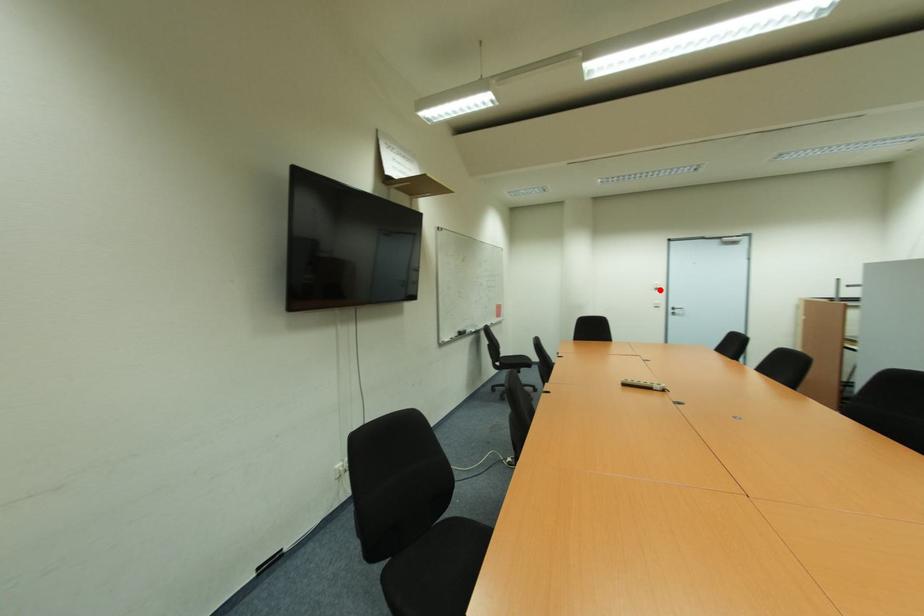
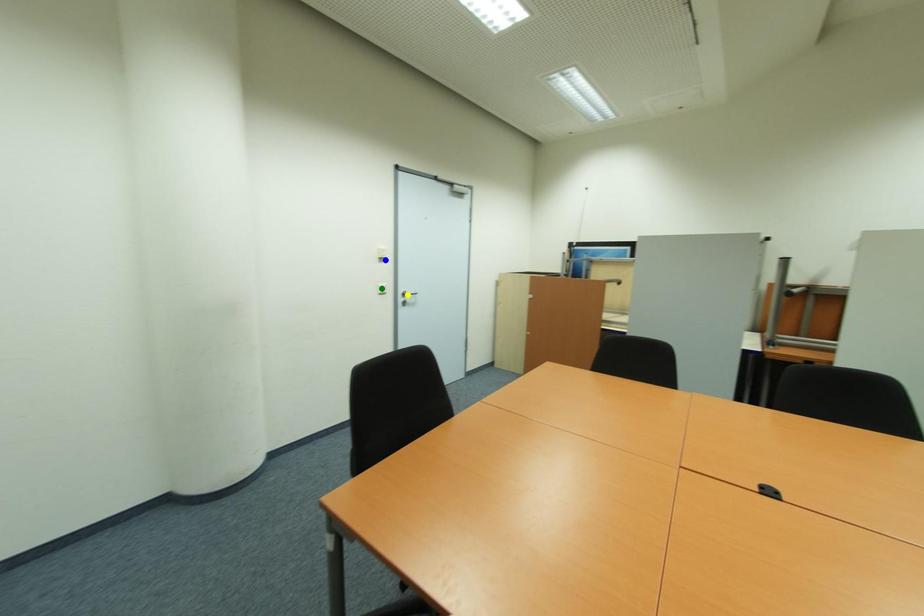
Question: I am providing you with two images of the same scene from different viewpoints. A red point is marked on the first image. You are given multiple points on the second image. Which mark in image 2 goes with the point in image 1?

Choices:
 (A) yellow point
 (B) green point
 (C) blue point

Answer: (C)